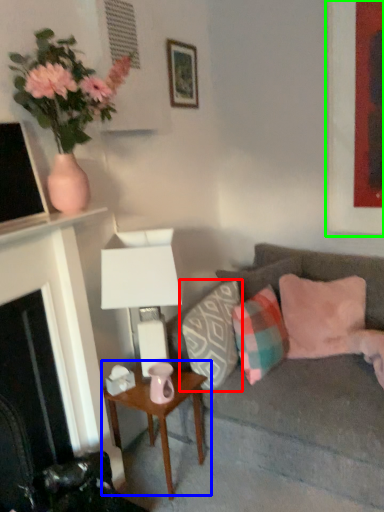
Question: Which is nearer to the pillow (highlighted by a red box)? table (highlighted by a blue box) or picture frame (highlighted by a green box).

Choices:
 (A) table
 (B) picture frame

Answer: (A)